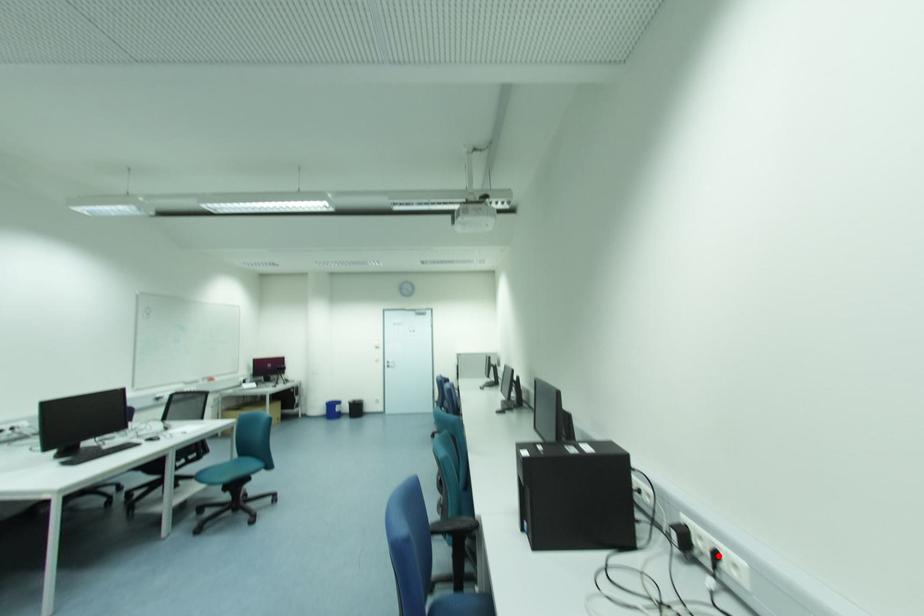
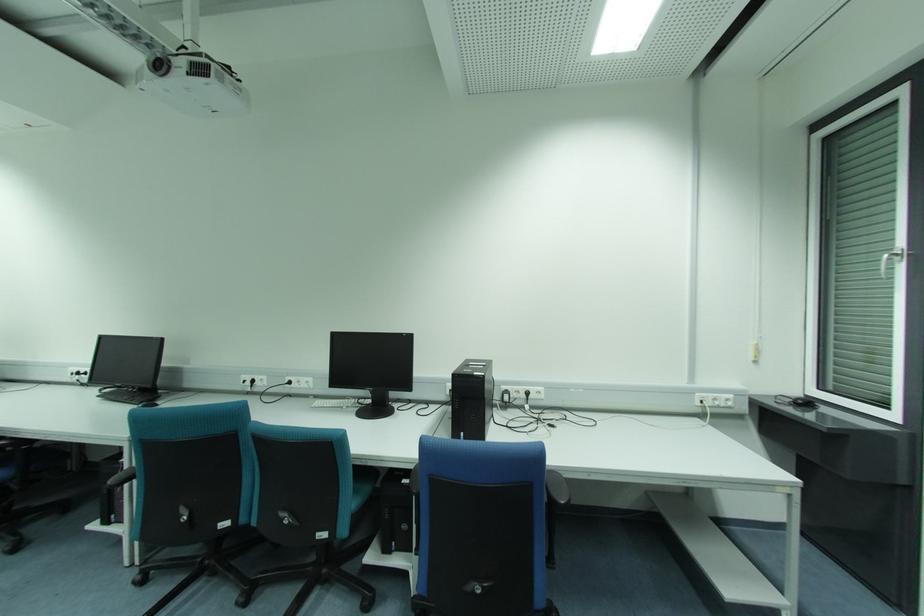
Where in the second image is the point corresponding to the highlighted location from the first image?

(528, 394)